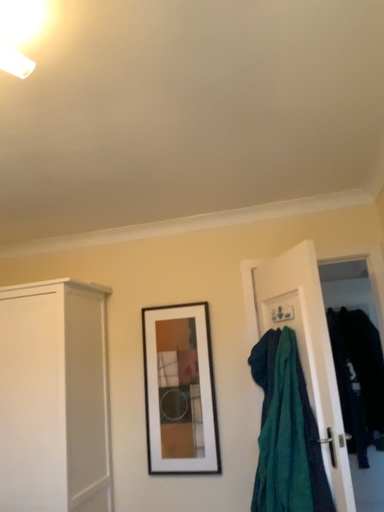
Question: From a real-world perspective, is wooden framed artwork at center over white matte cabinet at left?

Choices:
 (A) no
 (B) yes

Answer: (B)

Question: Is wooden framed artwork at center taller than white matte cabinet at left?

Choices:
 (A) no
 (B) yes

Answer: (A)

Question: Can you confirm if wooden framed artwork at center is bigger than white matte cabinet at left?

Choices:
 (A) yes
 (B) no

Answer: (B)

Question: From a real-world perspective, is wooden framed artwork at center beneath white matte cabinet at left?

Choices:
 (A) no
 (B) yes

Answer: (A)

Question: Is wooden framed artwork at center at the left side of white matte cabinet at left?

Choices:
 (A) yes
 (B) no

Answer: (B)

Question: In the image, is teal fabric at right positioned in front of or behind wooden framed artwork at center?

Choices:
 (A) front
 (B) behind

Answer: (A)

Question: From the image's perspective, is teal fabric at right located above or below wooden framed artwork at center?

Choices:
 (A) below
 (B) above

Answer: (B)

Question: Is point (264, 323) closer or farther from the camera than point (183, 415)?

Choices:
 (A) closer
 (B) farther

Answer: (A)

Question: Is teal fabric at right spatially inside wooden framed artwork at center, or outside of it?

Choices:
 (A) outside
 (B) inside

Answer: (A)

Question: From the image's perspective, is wooden framed artwork at center positioned above or below dark blue fabric at right?

Choices:
 (A) above
 (B) below

Answer: (A)

Question: Would you say wooden framed artwork at center is inside or outside dark blue fabric at right?

Choices:
 (A) inside
 (B) outside

Answer: (B)

Question: Would you say wooden framed artwork at center is to the left or to the right of dark blue fabric at right in the picture?

Choices:
 (A) right
 (B) left

Answer: (B)

Question: In terms of size, does wooden framed artwork at center appear bigger or smaller than dark blue fabric at right?

Choices:
 (A) small
 (B) big

Answer: (A)

Question: From a real-world perspective, is wooden framed artwork at center positioned above or below teal fabric at right?

Choices:
 (A) above
 (B) below

Answer: (B)

Question: Is wooden framed artwork at center taller or shorter than teal fabric at right?

Choices:
 (A) tall
 (B) short

Answer: (B)